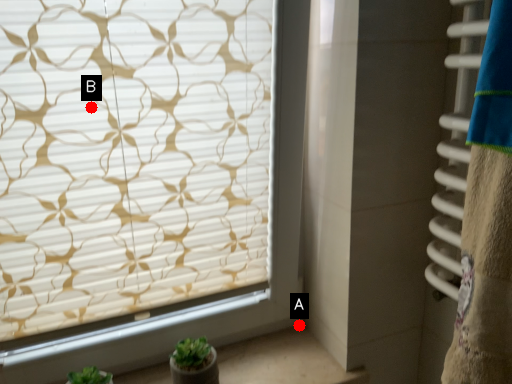
Question: Two points are circled on the image, labeled by A and B beside each circle. Among these points, which one is farthest from the camera?

Choices:
 (A) A is further
 (B) B is further

Answer: (A)